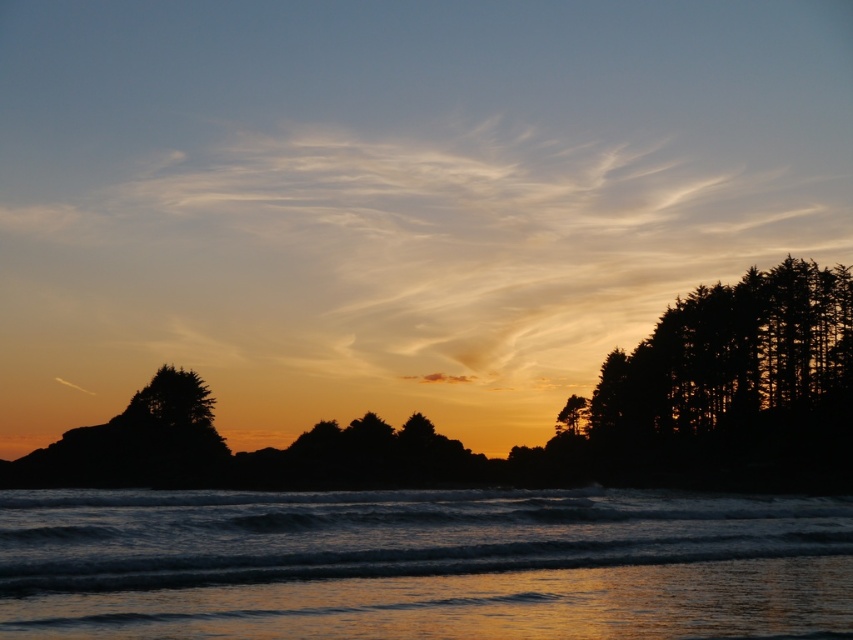
From the picture: You are a photographer standing at the center of the scene. You want to capture the shiny golden water at lower center in your photo. Based on its coordinates, where should you position your camera to ensure it is centered in the frame?

The shiny golden water at lower center is located at coordinates point (421, 564). To center it in your photo, position your camera so that the center of the frame aligns with these coordinates.